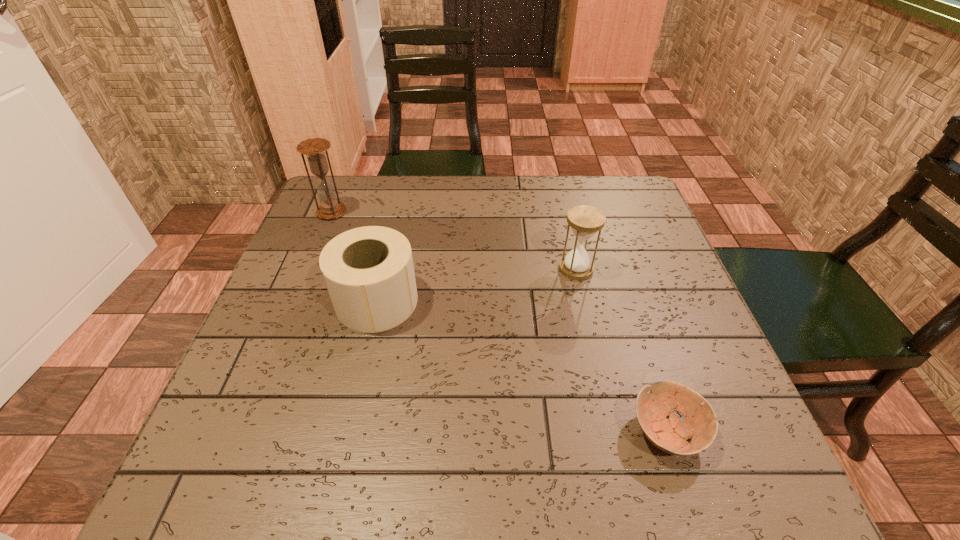
Image resolution: width=960 pixels, height=540 pixels. In the image, there is a desktop. Find the location of `blank space at the left edge`. blank space at the left edge is located at coordinates (287, 416).

In the image, there is a desktop. At what (x,y) coordinates should I click in order to perform the action: click on vacant space at the right edge. Please return your answer as a coordinate pair (x, y). This screenshot has height=540, width=960. Looking at the image, I should click on (638, 227).

Identify the location of vacant region at the near left corner of the desktop. (223, 477).

The width and height of the screenshot is (960, 540). Find the location of `free space at the far right corner`. free space at the far right corner is located at coordinates (577, 176).

Where is `vacant point located between the shorter hourglass and the toilet tissue`? The image size is (960, 540). vacant point located between the shorter hourglass and the toilet tissue is located at coordinates (476, 285).

Find the location of a particular element. This screenshot has width=960, height=540. blank region between the bowl and the toilet tissue is located at coordinates (521, 366).

Find the location of a particular element. The width and height of the screenshot is (960, 540). vacant area between the left hourglass and the bowl is located at coordinates (499, 322).

You are a GUI agent. You are given a task and a screenshot of the screen. Output one action in this format:
    pyautogui.click(x=<x>, y=<y>)
    Task: Click on the vacant area between the right hourglass and the tallest object
    
    Given the screenshot: What is the action you would take?
    pyautogui.click(x=454, y=240)

Locate an element on the screen. This screenshot has width=960, height=540. free space between the toilet tissue and the nearer hourglass is located at coordinates (476, 285).

Find the location of `free area in between the bowl and the taller hourglass`. free area in between the bowl and the taller hourglass is located at coordinates (499, 322).